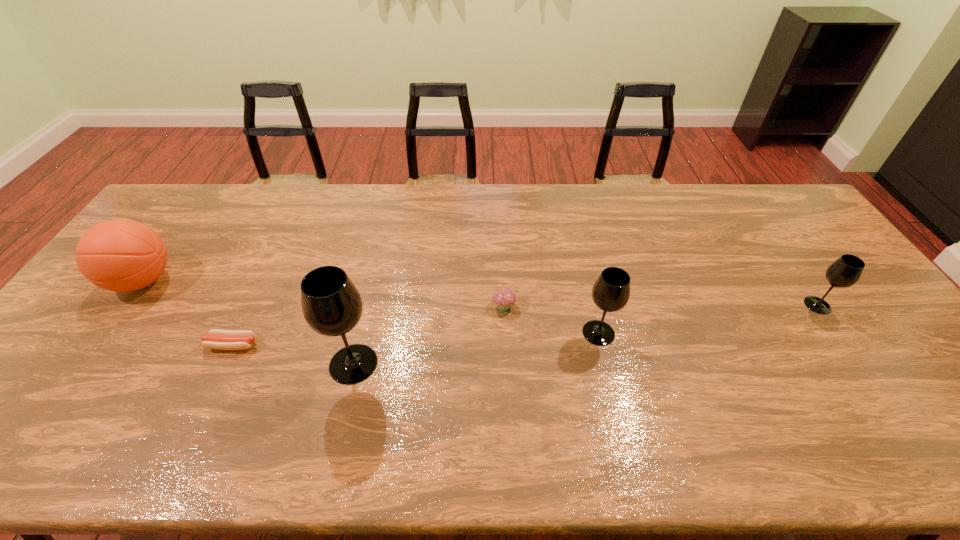
In order to click on vacant point located between the shortest object and the fourth object from left to right in this screenshot , I will do `click(369, 325)`.

The width and height of the screenshot is (960, 540). I want to click on free space between the leftmost object and the leftmost wineglass, so click(248, 322).

Image resolution: width=960 pixels, height=540 pixels. Identify the location of unoccupied position between the second wineglass from right to left and the cupcake. (551, 319).

Where is `vacant area that lies between the rightmost wineglass and the shortest object`? Image resolution: width=960 pixels, height=540 pixels. vacant area that lies between the rightmost wineglass and the shortest object is located at coordinates (525, 325).

The image size is (960, 540). I want to click on free space that is in between the leftmost wineglass and the basketball, so click(248, 322).

This screenshot has width=960, height=540. What are the coordinates of `free point between the second wineglass from left to right and the fifth object from right to left` in the screenshot? It's located at point(416,339).

Where is `object that stands as the fourth closest to the basketball`? The image size is (960, 540). object that stands as the fourth closest to the basketball is located at coordinates (611, 291).

I want to click on the closest object relative to the sausage, so click(332, 306).

Locate which wineglass is the second closest to the shortest object. Please provide its 2D coordinates. Your answer should be formatted as a tuple, i.e. [(x, y)], where the tuple contains the x and y coordinates of a point satisfying the conditions above.

[(611, 291)]

Image resolution: width=960 pixels, height=540 pixels. Identify the location of wineglass object that ranks as the closest to the fifth object from right to left. [332, 306].